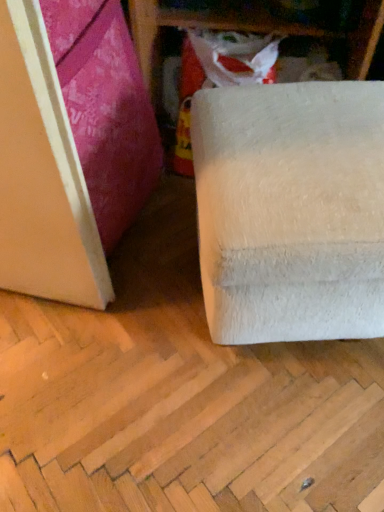
The width and height of the screenshot is (384, 512). Describe the element at coordinates (291, 210) in the screenshot. I see `white fluffy ottoman at lower right` at that location.

Image resolution: width=384 pixels, height=512 pixels. Find the location of `white fluffy ottoman at lower right`. white fluffy ottoman at lower right is located at coordinates (291, 210).

Find the location of a particular element. This screenshot has height=512, width=384. white fluffy ottoman at lower right is located at coordinates (291, 210).